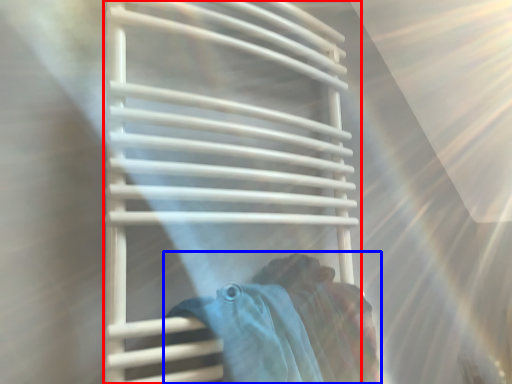
Question: Which object appears closest to the camera in this image, towel rack (highlighted by a red box) or woman (highlighted by a blue box)?

Choices:
 (A) towel rack
 (B) woman

Answer: (A)